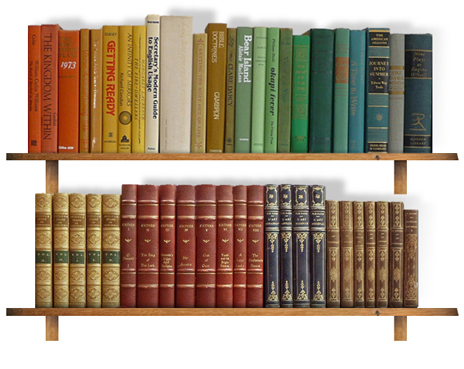
Where is `red books`? Image resolution: width=464 pixels, height=369 pixels. red books is located at coordinates (126, 252), (145, 256), (167, 254), (181, 252), (204, 254), (223, 251), (239, 251), (256, 251).